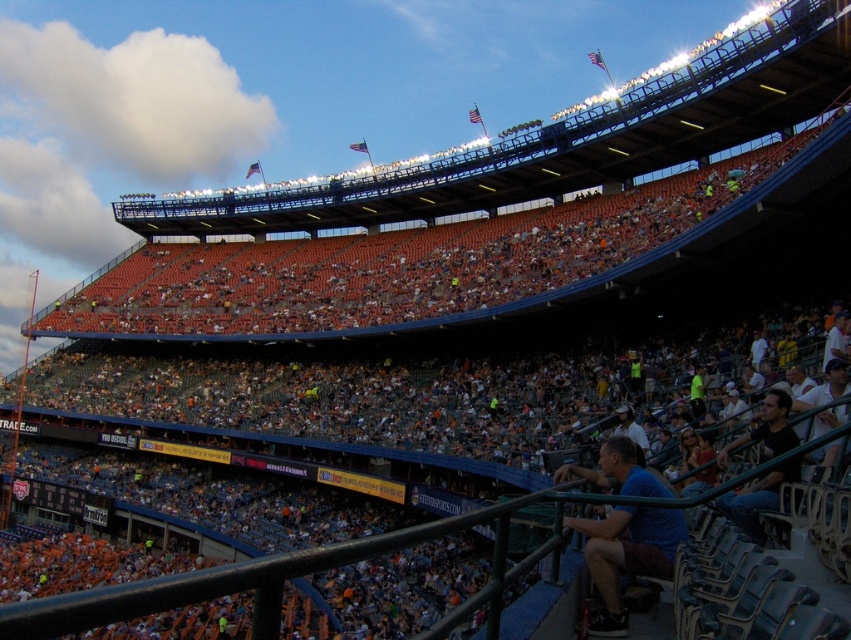
Does point (652, 536) lie behind point (840, 417)?

No, (652, 536) is in front of (840, 417).

Between blue cotton shirt at lower right and white fabric shirt at lower right, which one has more height?

Standing taller between the two is blue cotton shirt at lower right.

Is point (597, 483) positioned after point (838, 412)?

No.

In order to click on blue cotton shirt at lower right in this screenshot , I will do `click(627, 554)`.